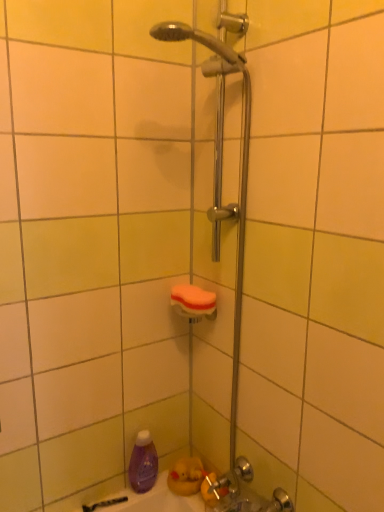
Question: Looking at the image, does purple matte bottle at lower left seem bigger or smaller compared to orange sponge at center?

Choices:
 (A) small
 (B) big

Answer: (B)

Question: From a real-world perspective, is purple matte bottle at lower left physically located above or below orange sponge at center?

Choices:
 (A) above
 (B) below

Answer: (B)

Question: Relative to orange sponge at center, is purple matte bottle at lower left in front or behind?

Choices:
 (A) front
 (B) behind

Answer: (B)

Question: In terms of height, does orange sponge at center look taller or shorter compared to purple matte bottle at lower left?

Choices:
 (A) tall
 (B) short

Answer: (B)

Question: From the image's perspective, relative to purple matte bottle at lower left, is orange sponge at center above or below?

Choices:
 (A) above
 (B) below

Answer: (A)

Question: Do you think orange sponge at center is within purple matte bottle at lower left, or outside of it?

Choices:
 (A) inside
 (B) outside

Answer: (B)

Question: In terms of size, does orange sponge at center appear bigger or smaller than purple matte bottle at lower left?

Choices:
 (A) small
 (B) big

Answer: (A)